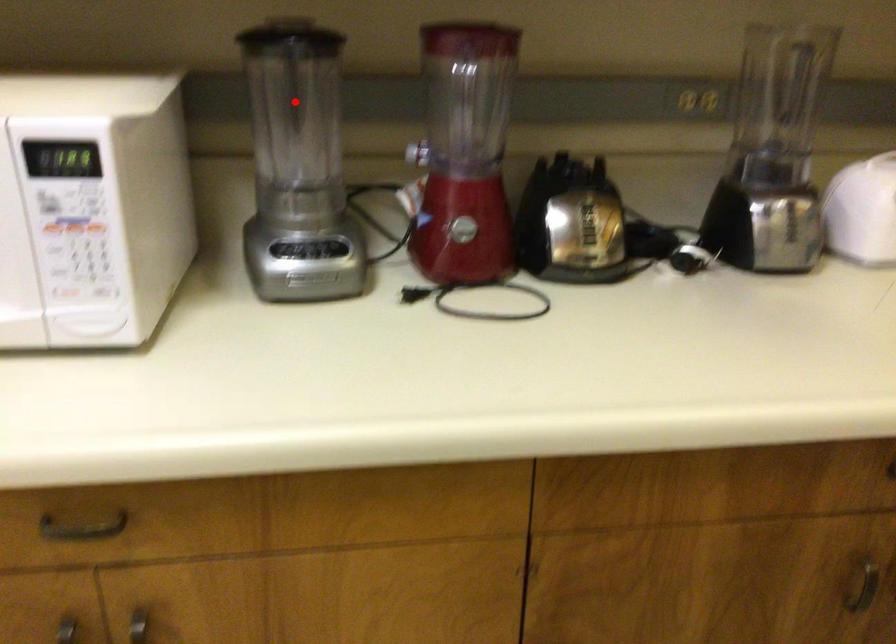
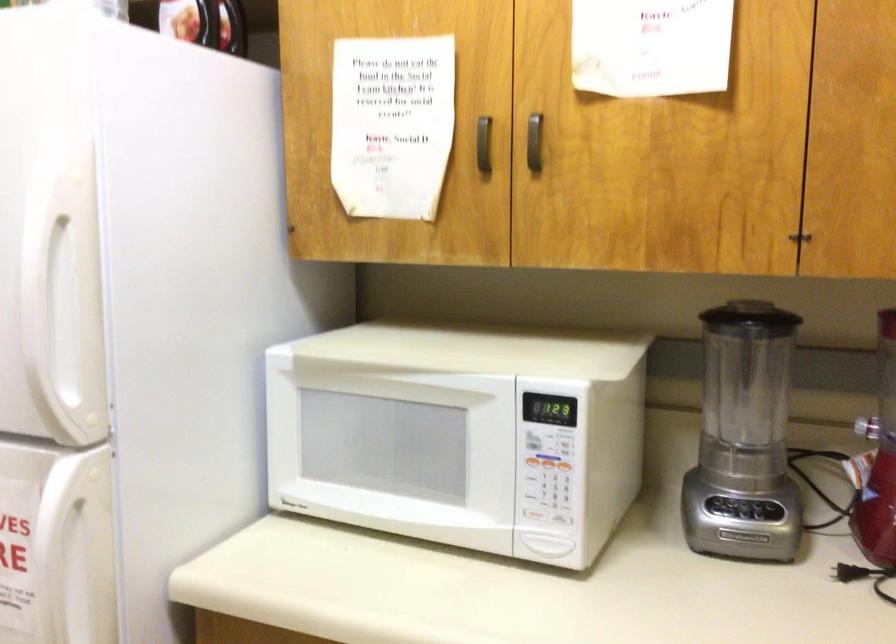
Question: I am providing you with two images of the same scene from different viewpoints. A red point is shown in image1. For the corresponding object point in image2, is it positioned nearer or farther from the camera?

Choices:
 (A) Nearer
 (B) Farther

Answer: (B)